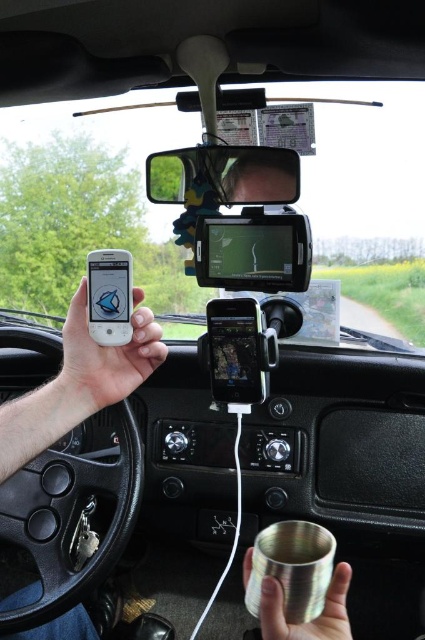
Question: Does white matte phone at center left appear under matte black phone at upper left?

Choices:
 (A) no
 (B) yes

Answer: (B)

Question: Is matte black phone at upper left thinner than brushed metal cup at lower center?

Choices:
 (A) yes
 (B) no

Answer: (A)

Question: Which of these objects is positioned farthest from the brushed metal cup at lower center?

Choices:
 (A) matte black phone at upper left
 (B) clear plastic view mirror at upper center

Answer: (B)

Question: Can you confirm if white matte phone at center left is bigger than matte black phone at upper left?

Choices:
 (A) yes
 (B) no

Answer: (A)

Question: Which of the following is the farthest from the observer?

Choices:
 (A) (300, 637)
 (B) (107, 248)
 (C) (221, 145)
 (D) (79, 348)

Answer: (B)

Question: Which of the following is the farthest from the observer?

Choices:
 (A) white matte phone at center left
 (B) brushed metal cup at lower center
 (C) matte black phone at upper left
 (D) clear plastic view mirror at upper center

Answer: (D)